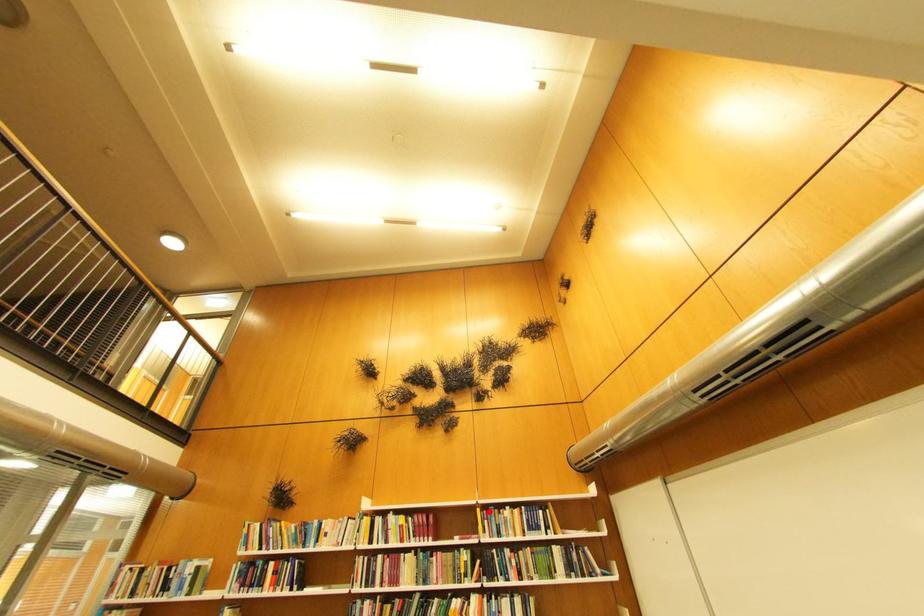
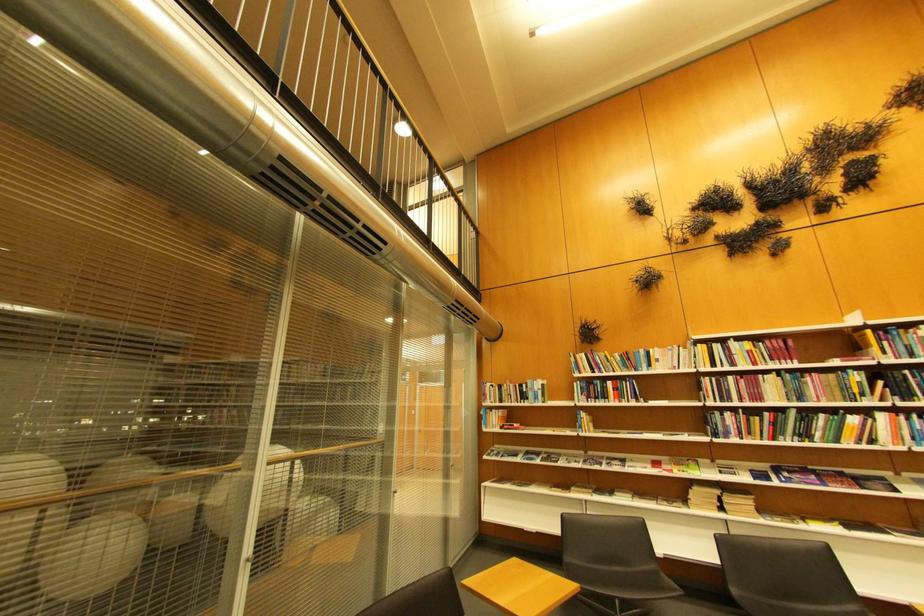
Question: I am providing you with two images of the same scene from different viewpoints. A red point is shown in image1. For the corresponding object point in image2, is it positioned nearer or farther from the camera?

Choices:
 (A) Nearer
 (B) Farther

Answer: (A)